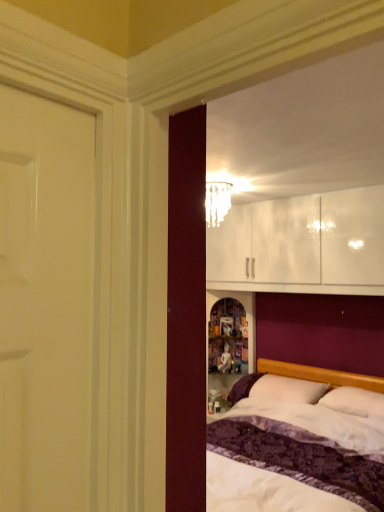
The height and width of the screenshot is (512, 384). Describe the element at coordinates (217, 202) in the screenshot. I see `translucent glass chandelier at upper center` at that location.

Find the location of a particular element. white soft pillow at center, which ranks as the first pillow in right-to-left order is located at coordinates (355, 402).

Does translucent glass chandelier at upper center turn towards white soft pillow at center, arranged as the second pillow when viewed from the left?

No, translucent glass chandelier at upper center is not facing towards white soft pillow at center, arranged as the second pillow when viewed from the left.

At what (x,y) coordinates should I click in order to perform the action: click on the 1st pillow below when counting from the translucent glass chandelier at upper center (from the image's perspective). Please return your answer as a coordinate pair (x, y). Looking at the image, I should click on (355, 402).

From a real-world perspective, who is located lower, translucent glass chandelier at upper center or white soft pillow at center, which ranks as the first pillow in right-to-left order?

white soft pillow at center, which ranks as the first pillow in right-to-left order.

Does point (210, 207) appear closer or farther from the camera than point (354, 404)?

Point (210, 207) is positioned farther from the camera compared to point (354, 404).

From the image's perspective, is white soft pillow at center, arranged as the second pillow when viewed from the left, beneath translucent glass chandelier at upper center?

Indeed, from the image's perspective, white soft pillow at center, arranged as the second pillow when viewed from the left, is shown beneath translucent glass chandelier at upper center.

From a real-world perspective, who is located higher, white soft pillow at center, arranged as the second pillow when viewed from the left, or translucent glass chandelier at upper center?

translucent glass chandelier at upper center.

Between white soft pillow at center, which ranks as the first pillow in right-to-left order, and translucent glass chandelier at upper center, which one has larger width?

Wider between the two is white soft pillow at center, which ranks as the first pillow in right-to-left order.

From a real-world perspective, which pillow is the 1st one underneath the translucent glass chandelier at upper center? Please provide its 2D coordinates.

[(355, 402)]

Between point (215, 213) and point (301, 392), which one is positioned in front?

The point (301, 392) is closer to the camera.

Does translucent glass chandelier at upper center appear on the right side of white soft pillow at lower right, the first pillow when ordered from left to right?

No.

From the image's perspective, is translucent glass chandelier at upper center positioned above or below white soft pillow at lower right, the first pillow when ordered from left to right?

Clearly, from the image's perspective, translucent glass chandelier at upper center is above white soft pillow at lower right, the first pillow when ordered from left to right.

Considering the sizes of objects translucent glass chandelier at upper center and white soft pillow at lower right, the second pillow in the right-to-left sequence, in the image provided, who is shorter, translucent glass chandelier at upper center or white soft pillow at lower right, the second pillow in the right-to-left sequence,?

With less height is white soft pillow at lower right, the second pillow in the right-to-left sequence.

Could you tell me if white soft pillow at center, which ranks as the first pillow in right-to-left order, is turned towards white soft pillow at lower right, the first pillow when ordered from left to right?

No, white soft pillow at center, which ranks as the first pillow in right-to-left order, is not turned towards white soft pillow at lower right, the first pillow when ordered from left to right.

Is white soft pillow at center, arranged as the second pillow when viewed from the left, far away from white soft pillow at lower right, the second pillow in the right-to-left sequence?

No, white soft pillow at center, arranged as the second pillow when viewed from the left, is not far away from white soft pillow at lower right, the second pillow in the right-to-left sequence.

Is white soft pillow at center, which ranks as the first pillow in right-to-left order, closer to camera compared to white soft pillow at lower right, the second pillow in the right-to-left sequence?

Yes, it is in front of white soft pillow at lower right, the second pillow in the right-to-left sequence.

Locate an element on the screen. The width and height of the screenshot is (384, 512). pillow above the white soft pillow at lower right, the first pillow when ordered from left to right (from a real-world perspective) is located at coordinates (355, 402).

From the image's perspective, is white soft pillow at lower right, the second pillow in the right-to-left sequence, above or below translucent glass chandelier at upper center?

Clearly, from the image's perspective, white soft pillow at lower right, the second pillow in the right-to-left sequence, is below translucent glass chandelier at upper center.

Considering the positions of objects white soft pillow at lower right, the second pillow in the right-to-left sequence, and translucent glass chandelier at upper center in the image provided, who is more to the right, white soft pillow at lower right, the second pillow in the right-to-left sequence, or translucent glass chandelier at upper center?

Positioned to the right is white soft pillow at lower right, the second pillow in the right-to-left sequence.

In the scene shown: Considering the sizes of objects white soft pillow at lower right, the first pillow when ordered from left to right, and translucent glass chandelier at upper center in the image provided, who is taller, white soft pillow at lower right, the first pillow when ordered from left to right, or translucent glass chandelier at upper center?

Standing taller between the two is translucent glass chandelier at upper center.

Is white soft pillow at lower right, the first pillow when ordered from left to right, taller or shorter than white soft pillow at center, which ranks as the first pillow in right-to-left order?

Clearly, white soft pillow at lower right, the first pillow when ordered from left to right, is taller compared to white soft pillow at center, which ranks as the first pillow in right-to-left order.

The image size is (384, 512). What are the coordinates of `pillow that appears below the white soft pillow at center, arranged as the second pillow when viewed from the left (from a real-world perspective)` in the screenshot? It's located at (277, 388).

Which of these two, white soft pillow at lower right, the first pillow when ordered from left to right, or white soft pillow at center, which ranks as the first pillow in right-to-left order, is thinner?

With smaller width is white soft pillow at center, which ranks as the first pillow in right-to-left order.

Is white soft pillow at lower right, the first pillow when ordered from left to right, at the left side of white soft pillow at center, which ranks as the first pillow in right-to-left order?

Yes.

I want to click on the 2nd pillow counting from the right of the translucent glass chandelier at upper center, so click(x=355, y=402).

At what (x,y) coordinates should I click in order to perform the action: click on lamp above the white soft pillow at center, which ranks as the first pillow in right-to-left order (from the image's perspective). Please return your answer as a coordinate pair (x, y). Looking at the image, I should click on (217, 202).

Considering their positions, is white soft pillow at lower right, the second pillow in the right-to-left sequence, positioned further to white soft pillow at center, which ranks as the first pillow in right-to-left order, than translucent glass chandelier at upper center?

Among the two, translucent glass chandelier at upper center is located further to white soft pillow at center, which ranks as the first pillow in right-to-left order.

When comparing their distances from white soft pillow at lower right, the second pillow in the right-to-left sequence, does white soft pillow at center, which ranks as the first pillow in right-to-left order, or translucent glass chandelier at upper center seem further?

translucent glass chandelier at upper center is positioned further to the anchor white soft pillow at lower right, the second pillow in the right-to-left sequence.

Looking at the image, which one is located closer to white soft pillow at lower right, the first pillow when ordered from left to right, translucent glass chandelier at upper center or white soft pillow at center, which ranks as the first pillow in right-to-left order?

Among the two, white soft pillow at center, which ranks as the first pillow in right-to-left order, is located nearer to white soft pillow at lower right, the first pillow when ordered from left to right.

Based on their spatial positions, is translucent glass chandelier at upper center or white soft pillow at lower right, the second pillow in the right-to-left sequence, further from white soft pillow at center, arranged as the second pillow when viewed from the left?

translucent glass chandelier at upper center is further to white soft pillow at center, arranged as the second pillow when viewed from the left.

Estimate the real-world distances between objects in this image. Which object is closer to translucent glass chandelier at upper center, white soft pillow at lower right, the second pillow in the right-to-left sequence, or white soft pillow at center, arranged as the second pillow when viewed from the left?

white soft pillow at lower right, the second pillow in the right-to-left sequence, lies closer to translucent glass chandelier at upper center than the other object.

From the image, which object appears to be nearer to translucent glass chandelier at upper center, white soft pillow at center, arranged as the second pillow when viewed from the left, or white soft pillow at lower right, the first pillow when ordered from left to right?

white soft pillow at lower right, the first pillow when ordered from left to right, is closer to translucent glass chandelier at upper center.

Where is `pillow between translucent glass chandelier at upper center and white soft pillow at lower right, the first pillow when ordered from left to right, in the vertical direction`? The height and width of the screenshot is (512, 384). pillow between translucent glass chandelier at upper center and white soft pillow at lower right, the first pillow when ordered from left to right, in the vertical direction is located at coordinates (355, 402).